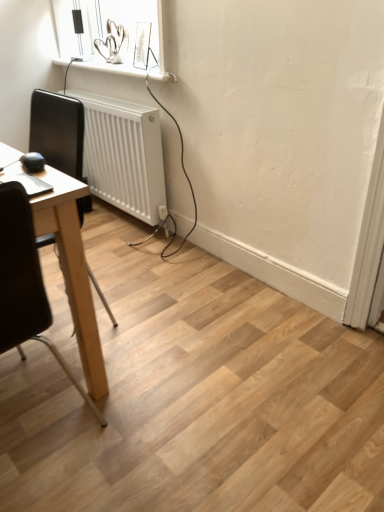
Question: Is black leather chair at left, the second chair positioned from the back, taller than black leather chair at left, positioned as the second chair in front-to-back order?

Choices:
 (A) no
 (B) yes

Answer: (A)

Question: Is black leather chair at left, the second chair positioned from the back, facing away from black leather chair at left, positioned as the second chair in front-to-back order?

Choices:
 (A) no
 (B) yes

Answer: (B)

Question: From a real-world perspective, is black leather chair at left, positioned as the first chair in front-to-back order, under black leather chair at left, positioned as the second chair in front-to-back order?

Choices:
 (A) no
 (B) yes

Answer: (B)

Question: Are black leather chair at left, positioned as the first chair in front-to-back order, and black leather chair at left, placed as the 1th chair when sorted from back to front, far apart?

Choices:
 (A) yes
 (B) no

Answer: (A)

Question: Considering the relative sizes of black leather chair at left, positioned as the first chair in front-to-back order, and black leather chair at left, placed as the 1th chair when sorted from back to front, in the image provided, is black leather chair at left, positioned as the first chair in front-to-back order, smaller than black leather chair at left, placed as the 1th chair when sorted from back to front,?

Choices:
 (A) yes
 (B) no

Answer: (B)

Question: Does black leather chair at left, the second chair positioned from the back, have a larger size compared to black leather chair at left, positioned as the second chair in front-to-back order?

Choices:
 (A) yes
 (B) no

Answer: (A)

Question: From the image's perspective, is black leather chair at left, positioned as the second chair in front-to-back order, located beneath white plastic radiator at lower left?

Choices:
 (A) no
 (B) yes

Answer: (B)

Question: Is black leather chair at left, placed as the 1th chair when sorted from back to front, behind white plastic radiator at lower left?

Choices:
 (A) yes
 (B) no

Answer: (B)

Question: Can you confirm if black leather chair at left, positioned as the second chair in front-to-back order, is shorter than white plastic radiator at lower left?

Choices:
 (A) no
 (B) yes

Answer: (A)

Question: Is black leather chair at left, positioned as the second chair in front-to-back order, in front of white plastic radiator at lower left?

Choices:
 (A) yes
 (B) no

Answer: (A)

Question: Is black leather chair at left, placed as the 1th chair when sorted from back to front, to the right of white plastic radiator at lower left from the viewer's perspective?

Choices:
 (A) no
 (B) yes

Answer: (A)

Question: Is black leather chair at left, positioned as the second chair in front-to-back order, smaller than white plastic radiator at lower left?

Choices:
 (A) yes
 (B) no

Answer: (B)

Question: Considering the relative sizes of black leather chair at left, positioned as the second chair in front-to-back order, and black leather chair at left, the second chair positioned from the back, in the image provided, is black leather chair at left, positioned as the second chair in front-to-back order, shorter than black leather chair at left, the second chair positioned from the back,?

Choices:
 (A) no
 (B) yes

Answer: (A)